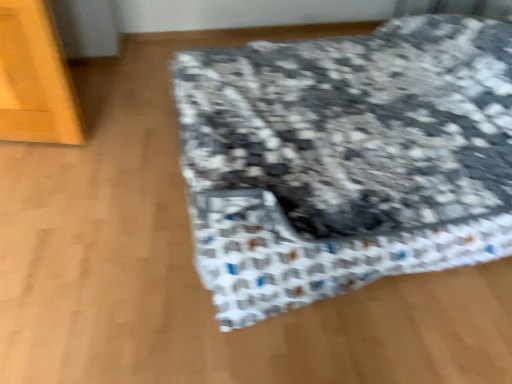
Question: Should I look upward or downward to see patterned fabric suitcase at center?

Choices:
 (A) up
 (B) down

Answer: (A)